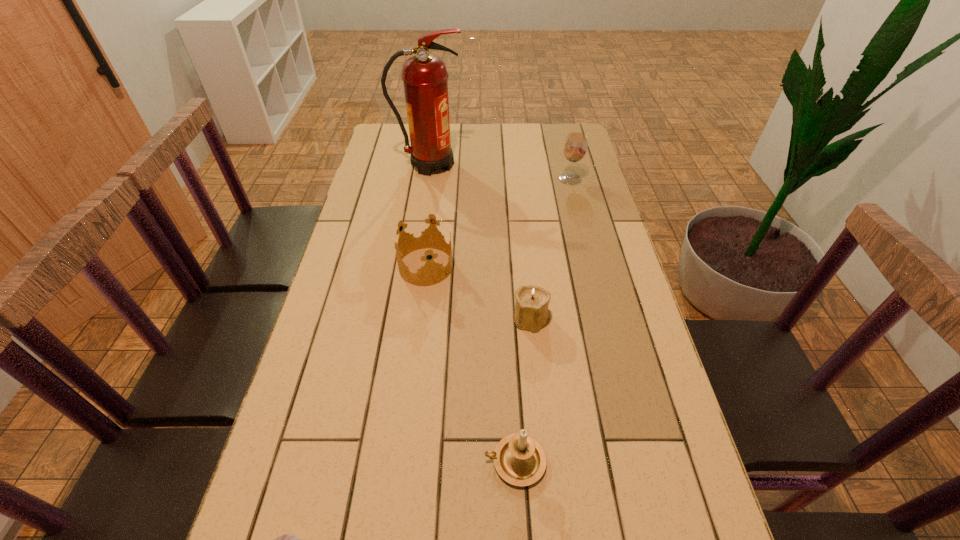
At what (x,y) coordinates should I click in order to perform the action: click on blank area located with a handle on the side of the nearer candle_holder. Please return your answer as a coordinate pair (x, y). Looking at the image, I should click on (413, 461).

The height and width of the screenshot is (540, 960). In order to click on vacant space positioned 0.050m with a handle on the side of the nearer candle_holder in this screenshot , I will do point(459,461).

I want to click on vacant space situated on the front of the farther candle_holder, so click(x=539, y=383).

This screenshot has height=540, width=960. What are the coordinates of `object that is at the far edge` in the screenshot? It's located at (424, 75).

The width and height of the screenshot is (960, 540). I want to click on object that is at the left edge, so click(x=424, y=75).

Locate an element on the screen. The image size is (960, 540). object at the right edge is located at coordinates (575, 146).

Locate an element on the screen. This screenshot has width=960, height=540. object positioned at the far left corner is located at coordinates (424, 75).

You are a GUI agent. You are given a task and a screenshot of the screen. Output one action in this format:
    pyautogui.click(x=<x>, y=<y>)
    Task: Click on the free space at the far edge of the desktop
    The width and height of the screenshot is (960, 540).
    Given the screenshot: What is the action you would take?
    pyautogui.click(x=521, y=133)

Identify the location of vacant space at the left edge. (363, 191).

At what (x,y) coordinates should I click in order to perform the action: click on free region at the right edge of the desktop. Please return your answer as a coordinate pair (x, y). This screenshot has height=540, width=960. Looking at the image, I should click on (626, 313).